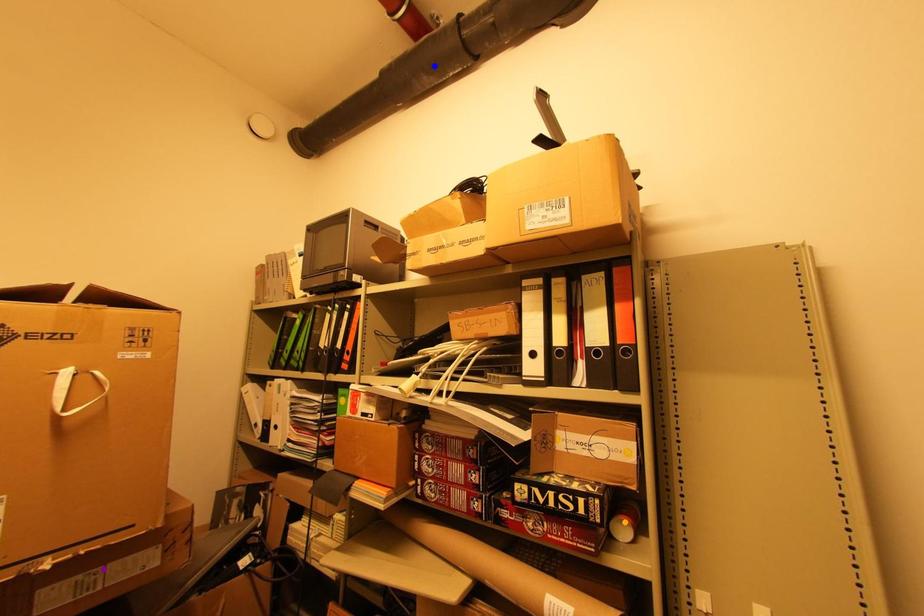
Order these from farthest to nearest:
blue point | orange point | purple point

1. blue point
2. orange point
3. purple point